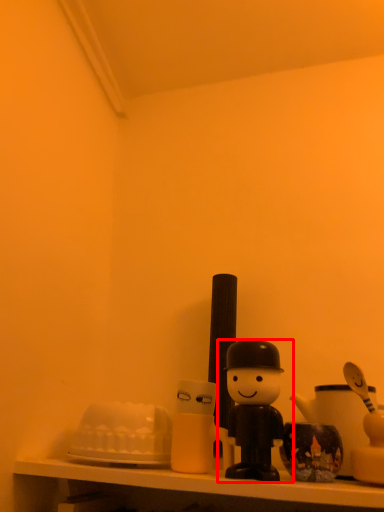
Question: From the image's perspective, considering the relative positions of toy (annotated by the red box) and shelf in the image provided, where is toy (annotated by the red box) located with respect to the staircase?

Choices:
 (A) below
 (B) above

Answer: (B)